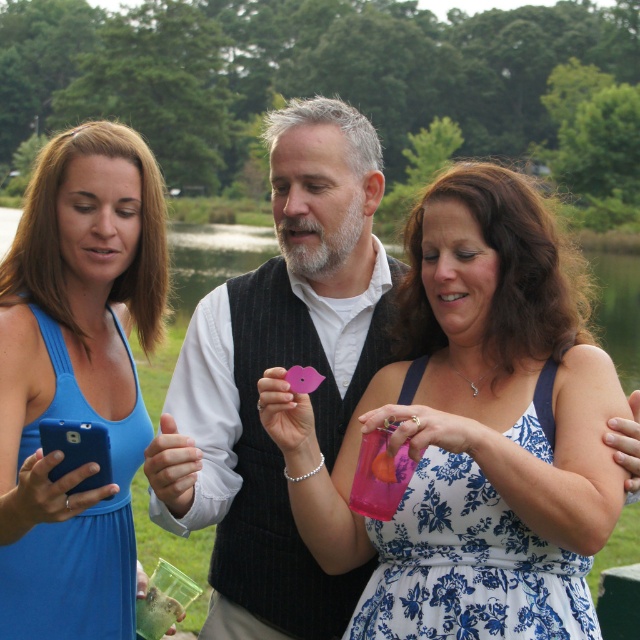
What do you see at coordinates (77, 348) in the screenshot? The width and height of the screenshot is (640, 640). I see `blue fabric dress at left` at bounding box center [77, 348].

Which is in front, point (17, 605) or point (625, 355)?

Point (17, 605) is more forward.

Identify the location of blue fabric dress at left. (77, 348).

Can you confirm if blue fabric dress at left is shorter than blue matte smartphone at lower left?

In fact, blue fabric dress at left may be taller than blue matte smartphone at lower left.

Which is behind, point (84, 280) or point (81, 484)?

The point (84, 280) is behind.

In order to click on blue fabric dress at left in this screenshot , I will do `click(77, 348)`.

Does green grass at center have a greater height compared to blue matte smartphone at lower left?

Yes.

Which is in front, point (273, 250) or point (88, 435)?

Point (88, 435) is in front.

Where is `green grass at center`? The image size is (640, 640). green grass at center is located at coordinates (202, 280).